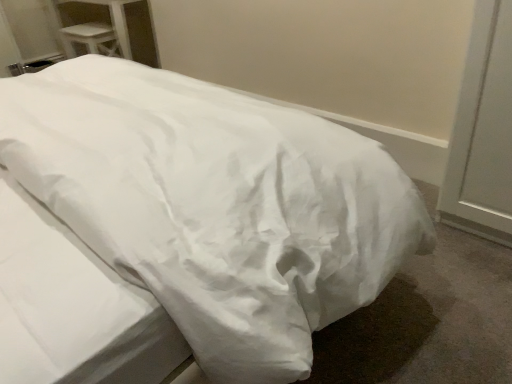
Locate an element on the screen. The width and height of the screenshot is (512, 384). white glossy table at upper left is located at coordinates (90, 38).

This screenshot has height=384, width=512. What do you see at coordinates (90, 38) in the screenshot?
I see `white glossy table at upper left` at bounding box center [90, 38].

Locate an element on the screen. The width and height of the screenshot is (512, 384). white glossy table at upper left is located at coordinates (90, 38).